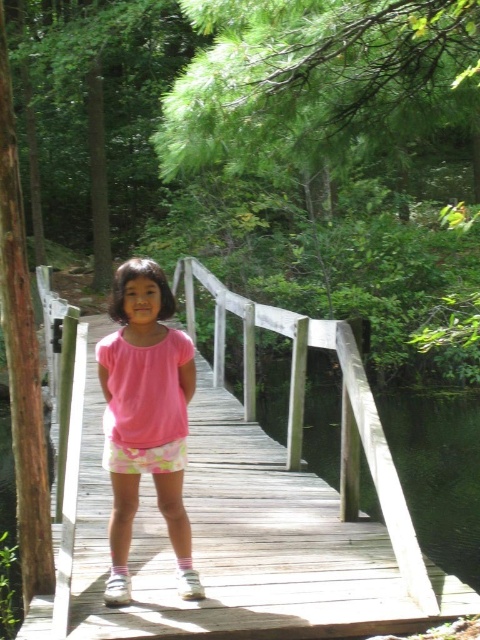
You are a photographer trying to capture the wooden bridge at center and the pink cotton shirt at center in a single shot. Based on their positions, which object is closer to the camera?

The wooden bridge at center is in front of the pink cotton shirt at center, so the wooden bridge at center is closer to the camera.

You are trying to cross the wooden bridge and want to avoid the transparent water at bridge right. Where should you step to stay safe?

The transparent water at bridge right is located at point (439, 472), so you should step away from that coordinate to avoid it and stay safe on the bridge.